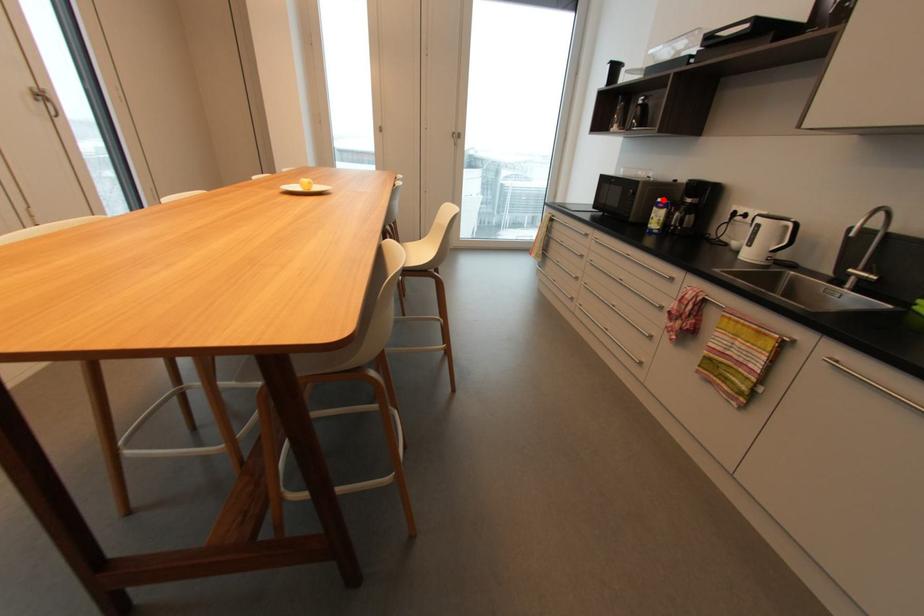
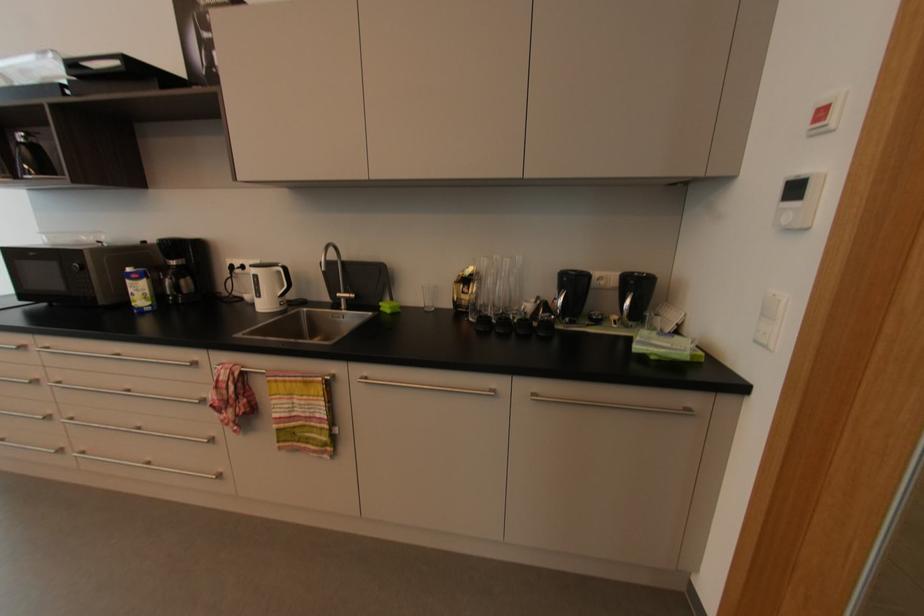
In the second image, find the point that corresponds to the highlighted location in the first image.

(131, 270)